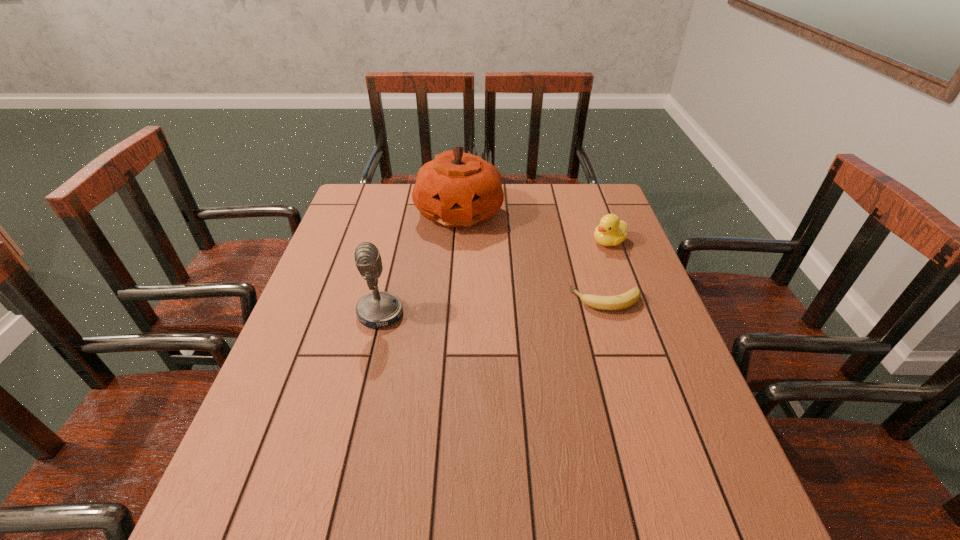
Find the location of a particular element. The image size is (960, 540). free space on the desktop that is between the microphone and the banana and is positioned on the front-facing side of the pumpkin is located at coordinates click(509, 307).

You are a GUI agent. You are given a task and a screenshot of the screen. Output one action in this format:
    pyautogui.click(x=<x>, y=<y>)
    Task: Click on the vacant spot on the desktop that is between the microphone and the banana and is positioned on the beak of the second shortest object
    The image size is (960, 540).
    Given the screenshot: What is the action you would take?
    pyautogui.click(x=481, y=308)